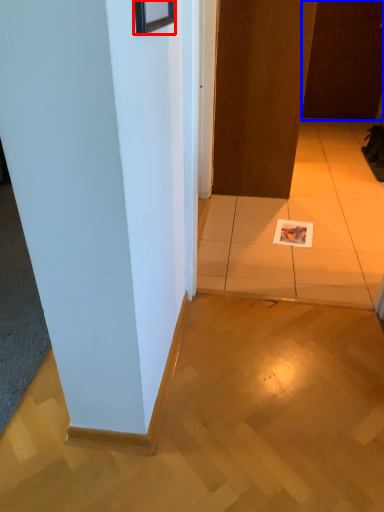
Question: Which object appears farthest to the camera in this image, picture frame (highlighted by a red box) or door (highlighted by a blue box)?

Choices:
 (A) picture frame
 (B) door

Answer: (B)